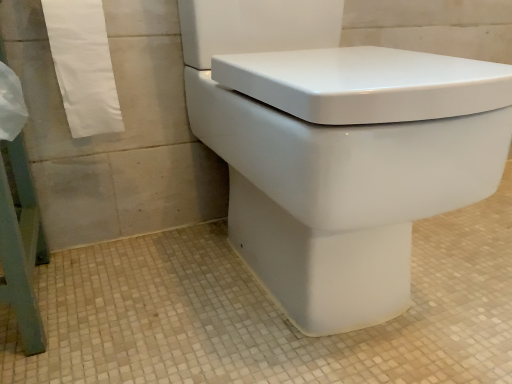
Question: Considering the relative sizes of white paper towel at left and white glossy toilet at center in the image provided, is white paper towel at left bigger than white glossy toilet at center?

Choices:
 (A) no
 (B) yes

Answer: (A)

Question: Are white paper towel at left and white glossy toilet at center making contact?

Choices:
 (A) yes
 (B) no

Answer: (B)

Question: Does white paper towel at left have a greater width compared to white glossy toilet at center?

Choices:
 (A) no
 (B) yes

Answer: (A)

Question: Considering the relative positions of white paper towel at left and white glossy toilet at center in the image provided, is white paper towel at left behind white glossy toilet at center?

Choices:
 (A) no
 (B) yes

Answer: (B)

Question: Does white paper towel at left appear on the right side of white glossy toilet at center?

Choices:
 (A) yes
 (B) no

Answer: (B)

Question: From the image's perspective, is white paper towel at left under white glossy toilet at center?

Choices:
 (A) yes
 (B) no

Answer: (B)

Question: Is white glossy toilet at center at the left side of white paper towel at left?

Choices:
 (A) yes
 (B) no

Answer: (B)

Question: Does white glossy toilet at center have a larger size compared to white paper towel at left?

Choices:
 (A) yes
 (B) no

Answer: (A)

Question: Considering the relative sizes of white glossy toilet at center and white paper towel at left in the image provided, is white glossy toilet at center wider than white paper towel at left?

Choices:
 (A) no
 (B) yes

Answer: (B)

Question: Is white glossy toilet at center far from white paper towel at left?

Choices:
 (A) yes
 (B) no

Answer: (B)

Question: From the image's perspective, is white glossy toilet at center below white paper towel at left?

Choices:
 (A) yes
 (B) no

Answer: (A)

Question: Is white glossy toilet at center shorter than white paper towel at left?

Choices:
 (A) yes
 (B) no

Answer: (B)

Question: Relative to white paper towel at left, is white glossy toilet at center in front or behind?

Choices:
 (A) behind
 (B) front

Answer: (B)